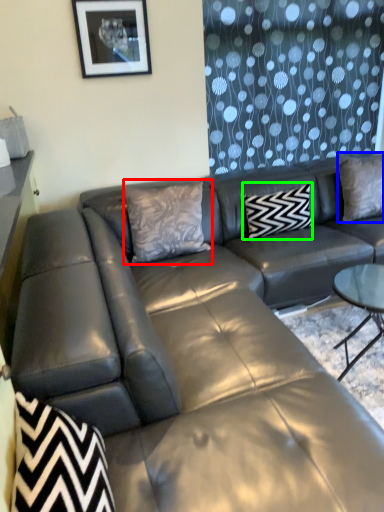
Question: Considering the real-world distances, which object is farthest from pillow (highlighted by a red box)? pillow (highlighted by a blue box) or pillow (highlighted by a green box)?

Choices:
 (A) pillow
 (B) pillow

Answer: (A)